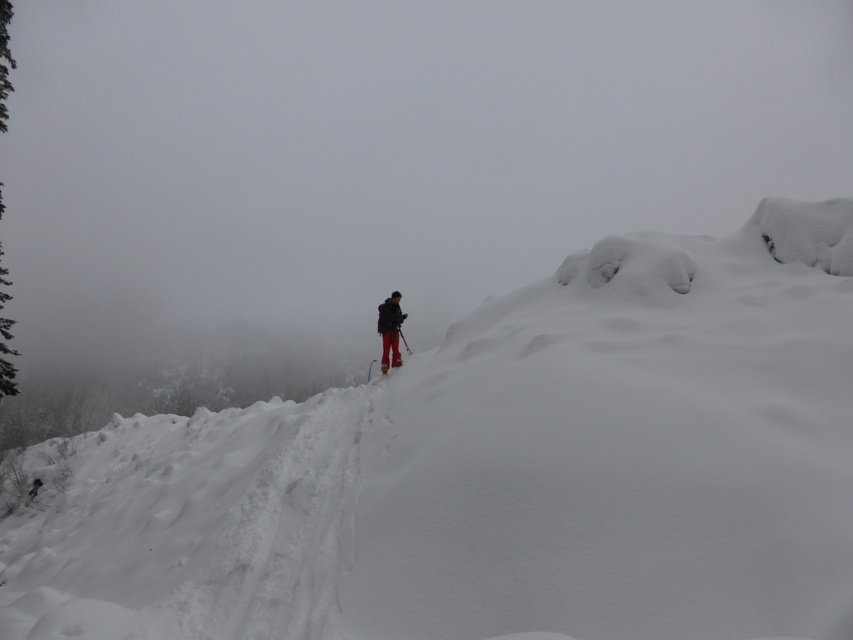
Question: Which point is closer to the camera?

Choices:
 (A) white fluffy snow at center
 (B) dark matte jacket at center
 (C) shiny metallic ski at center

Answer: (A)

Question: Does white fluffy snow at center appear on the right side of shiny metallic ski at center?

Choices:
 (A) yes
 (B) no

Answer: (B)

Question: Which point is closer to the camera taking this photo?

Choices:
 (A) (403, 320)
 (B) (367, 381)
 (C) (509, 561)

Answer: (C)

Question: Does white fluffy snow at center have a greater width compared to shiny metallic ski at center?

Choices:
 (A) yes
 (B) no

Answer: (A)

Question: Does white fluffy snow at center come behind dark matte jacket at center?

Choices:
 (A) yes
 (B) no

Answer: (B)

Question: Among these objects, which one is nearest to the camera?

Choices:
 (A) white fluffy snow at center
 (B) dark matte jacket at center

Answer: (A)